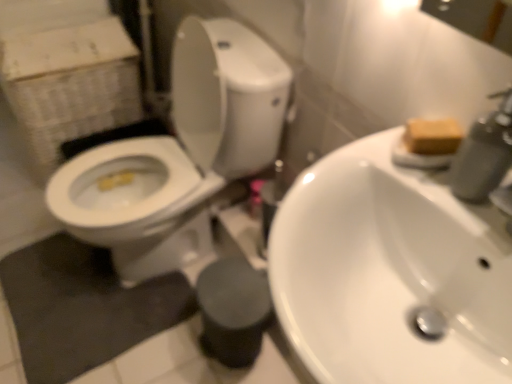
Question: From a real-world perspective, is white glossy sink at center below matte gray soap dispenser at upper right?

Choices:
 (A) yes
 (B) no

Answer: (A)

Question: Can we say white glossy sink at center lies outside matte gray soap dispenser at upper right?

Choices:
 (A) no
 (B) yes

Answer: (B)

Question: Is white glossy sink at center wider than matte gray soap dispenser at upper right?

Choices:
 (A) no
 (B) yes

Answer: (B)

Question: From the image's perspective, would you say white glossy sink at center is shown under matte gray soap dispenser at upper right?

Choices:
 (A) no
 (B) yes

Answer: (B)

Question: From a real-world perspective, does white glossy sink at center stand above matte gray soap dispenser at upper right?

Choices:
 (A) yes
 (B) no

Answer: (B)

Question: Considering the relative sizes of white glossy sink at center and matte gray soap dispenser at upper right in the image provided, is white glossy sink at center bigger than matte gray soap dispenser at upper right?

Choices:
 (A) no
 (B) yes

Answer: (B)

Question: Can you confirm if white cardboard box at left is shorter than white glossy toilet at left?

Choices:
 (A) no
 (B) yes

Answer: (B)

Question: Is white cardboard box at left not within white glossy toilet at left?

Choices:
 (A) no
 (B) yes

Answer: (B)

Question: Is white cardboard box at left to the right of white glossy toilet at left from the viewer's perspective?

Choices:
 (A) no
 (B) yes

Answer: (A)

Question: Is white cardboard box at left facing towards white glossy toilet at left?

Choices:
 (A) yes
 (B) no

Answer: (B)

Question: From a real-world perspective, is white cardboard box at left beneath white glossy toilet at left?

Choices:
 (A) no
 (B) yes

Answer: (B)

Question: Is white cardboard box at left in front of white glossy toilet at left?

Choices:
 (A) yes
 (B) no

Answer: (B)

Question: Can you confirm if brown matte soap at upper right is bigger than white glossy sink at center?

Choices:
 (A) no
 (B) yes

Answer: (A)